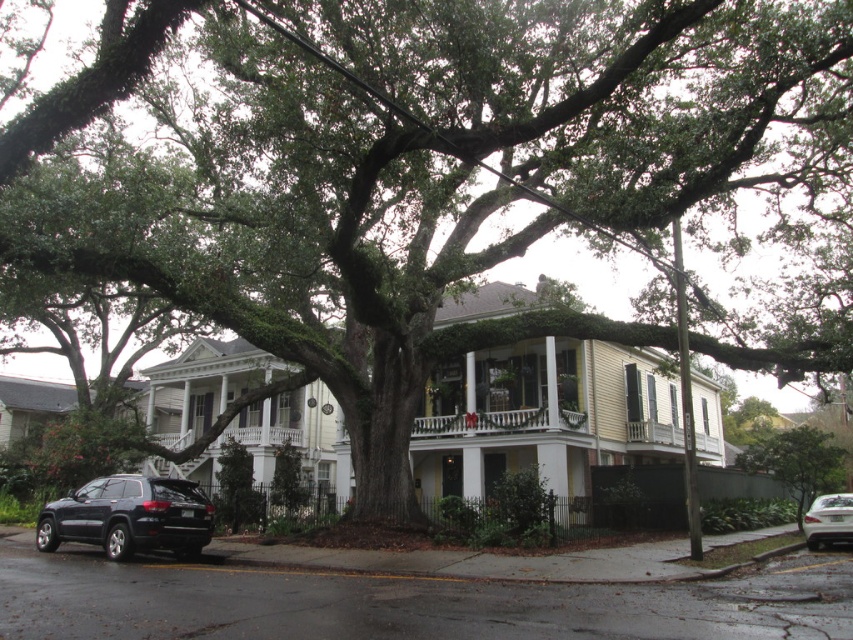
Question: Can you confirm if black matte suv at lower left is positioned to the right of silver metallic sedan at lower right?

Choices:
 (A) no
 (B) yes

Answer: (A)

Question: Can you confirm if black matte suv at lower left is positioned above green leafy tree at center?

Choices:
 (A) no
 (B) yes

Answer: (B)

Question: Which point appears farthest from the camera in this image?

Choices:
 (A) (583, 419)
 (B) (834, 529)
 (C) (817, 444)
 (D) (54, 531)

Answer: (A)

Question: Among these objects, which one is farthest from the camera?

Choices:
 (A) white painted wood porch at center
 (B) silver metallic sedan at lower right
 (C) green leafy tree at center
 (D) black matte suv at lower left

Answer: (A)

Question: Among these objects, which one is nearest to the camera?

Choices:
 (A) white painted wood porch at center
 (B) silver metallic sedan at lower right

Answer: (B)

Question: Is black matte suv at lower left positioned in front of white painted wood porch at center?

Choices:
 (A) no
 (B) yes

Answer: (B)